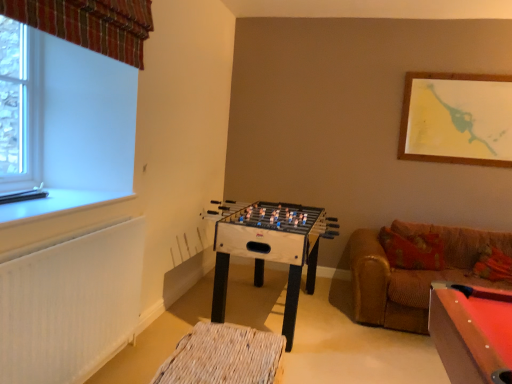
Question: Considering the relative sizes of woven wood footrest at lower center and white plastic window sill at left in the image provided, is woven wood footrest at lower center taller than white plastic window sill at left?

Choices:
 (A) yes
 (B) no

Answer: (A)

Question: Is woven wood footrest at lower center oriented away from white plastic window sill at left?

Choices:
 (A) yes
 (B) no

Answer: (B)

Question: Is woven wood footrest at lower center closer to the viewer compared to white plastic window sill at left?

Choices:
 (A) no
 (B) yes

Answer: (B)

Question: From the image's perspective, is woven wood footrest at lower center beneath white plastic window sill at left?

Choices:
 (A) yes
 (B) no

Answer: (A)

Question: Is woven wood footrest at lower center bigger than white plastic window sill at left?

Choices:
 (A) yes
 (B) no

Answer: (A)

Question: Is woven wood footrest at lower center at the right side of white plastic window sill at left?

Choices:
 (A) yes
 (B) no

Answer: (A)

Question: Considering the relative positions of plaid fabric curtain at upper left and brown leather couch at right in the image provided, is plaid fabric curtain at upper left to the left of brown leather couch at right from the viewer's perspective?

Choices:
 (A) no
 (B) yes

Answer: (B)

Question: Does plaid fabric curtain at upper left have a lesser width compared to brown leather couch at right?

Choices:
 (A) yes
 (B) no

Answer: (A)

Question: From a real-world perspective, is plaid fabric curtain at upper left on brown leather couch at right?

Choices:
 (A) yes
 (B) no

Answer: (A)

Question: From the image's perspective, is plaid fabric curtain at upper left under brown leather couch at right?

Choices:
 (A) yes
 (B) no

Answer: (B)

Question: Is the position of plaid fabric curtain at upper left less distant than that of brown leather couch at right?

Choices:
 (A) no
 (B) yes

Answer: (B)

Question: From the image's perspective, is plaid fabric curtain at upper left over brown leather couch at right?

Choices:
 (A) yes
 (B) no

Answer: (A)

Question: From the image's perspective, is plaid fabric curtain at upper left over white plastic window sill at left?

Choices:
 (A) yes
 (B) no

Answer: (A)